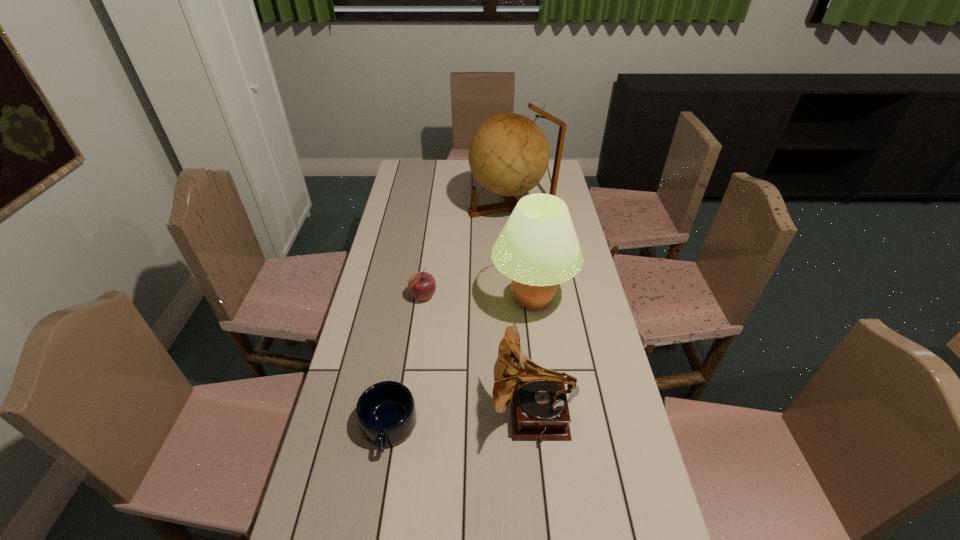
Find the location of `free space located 0.160m on the shade of the second tallest object`. free space located 0.160m on the shade of the second tallest object is located at coordinates (444, 300).

This screenshot has width=960, height=540. I want to click on free region located on the shade of the second tallest object, so click(x=399, y=300).

This screenshot has height=540, width=960. Find the location of `vacant space located on the horn of the third shortest object`. vacant space located on the horn of the third shortest object is located at coordinates (446, 415).

This screenshot has height=540, width=960. What are the coordinates of `vacant region located on the horn of the third shortest object` in the screenshot? It's located at (417, 415).

Where is `vacant point located on the horn of the third shortest object`? This screenshot has height=540, width=960. vacant point located on the horn of the third shortest object is located at coordinates (383, 415).

The width and height of the screenshot is (960, 540). In order to click on vacant space located on the front of the fourth tallest object in this screenshot , I will do `click(420, 317)`.

Find the location of `free space located 0.130m with the handle on the side of the shortest object`. free space located 0.130m with the handle on the side of the shortest object is located at coordinates (373, 517).

Find the location of `object that is at the far edge`. object that is at the far edge is located at coordinates click(508, 154).

In order to click on apple positioned at the left edge in this screenshot , I will do `click(422, 285)`.

This screenshot has width=960, height=540. Identify the location of mug positioned at the left edge. (386, 413).